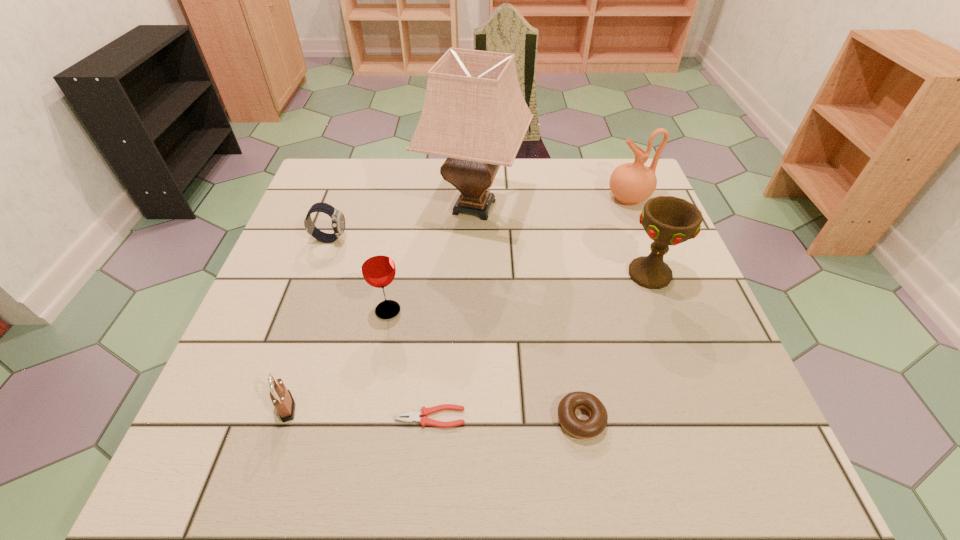
The height and width of the screenshot is (540, 960). I want to click on lampshade, so click(474, 113).

This screenshot has height=540, width=960. What are the coordinates of `pottery` in the screenshot? It's located at coord(631,183).

The height and width of the screenshot is (540, 960). What are the coordinates of `chalice` in the screenshot? It's located at (668, 220).

You are a GUI agent. You are given a task and a screenshot of the screen. Output one action in this format:
    pyautogui.click(x=<x>, y=<y>)
    Task: Click on the fifth farthest object
    The width and height of the screenshot is (960, 540).
    Given the screenshot: What is the action you would take?
    [x=378, y=268]

At what (x,y) coordinates should I click in order to perform the action: click on watch. Please return your answer as a coordinate pair (x, y). The width and height of the screenshot is (960, 540). Looking at the image, I should click on (338, 220).

This screenshot has height=540, width=960. What are the coordinates of `padlock` in the screenshot? It's located at (282, 399).

What are the coordinates of `doughnut` in the screenshot? It's located at (583, 429).

The width and height of the screenshot is (960, 540). Identify the location of the second shortest object. (583, 429).

The image size is (960, 540). Find the location of `pliers`. pliers is located at coordinates 424,412.

I want to click on vacant space situated 0.190m on the front of the lampshade, so click(473, 302).